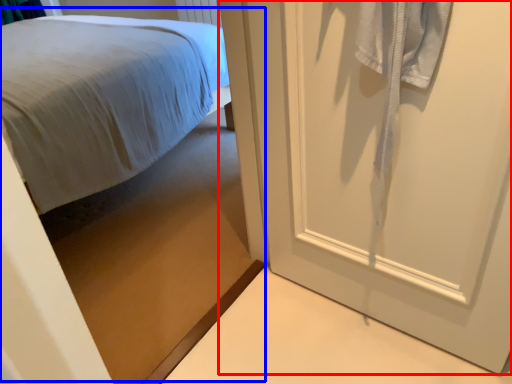
Question: Among these objects, which one is nearest to the camera, door (highlighted by a red box) or bed (highlighted by a blue box)?

Choices:
 (A) door
 (B) bed

Answer: (B)